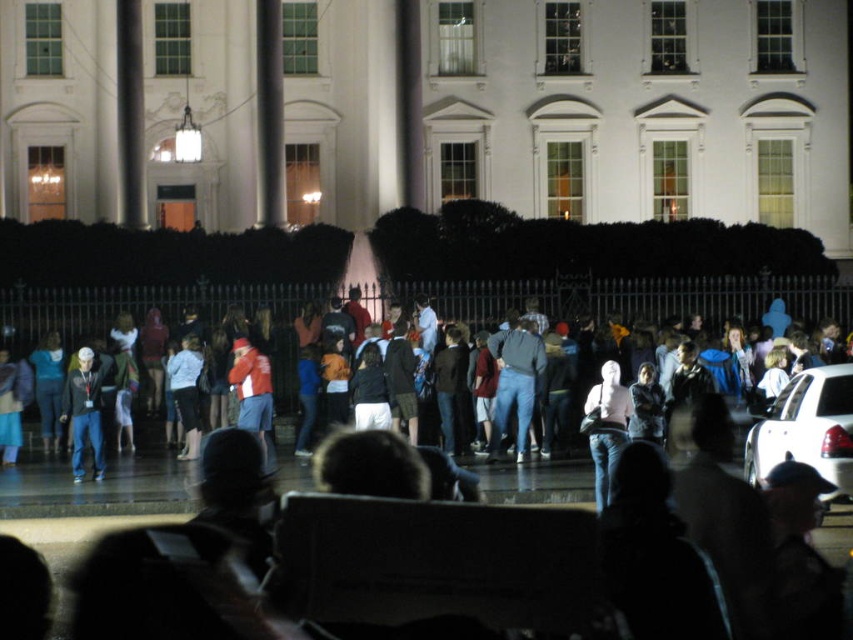
Does denim jacket at center have a larger size compared to matte black jacket at left?

Yes.

Find the location of `denim jacket at center`. denim jacket at center is located at coordinates (653, 305).